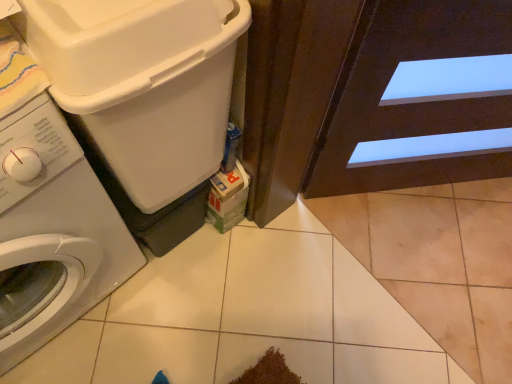
Question: Considering the positions of white plastic washing machine at left, the 1th washing machine viewed from the right, and white glossy washing machine at left, which is the second washing machine in right-to-left order, in the image, is white plastic washing machine at left, the 1th washing machine viewed from the right, taller or shorter than white glossy washing machine at left, which is the second washing machine in right-to-left order,?

Choices:
 (A) tall
 (B) short

Answer: (B)

Question: Looking at their shapes, would you say white plastic washing machine at left, the 2th washing machine when ordered from left to right, is wider or thinner than white glossy washing machine at left, placed as the 1th washing machine when sorted from left to right?

Choices:
 (A) thin
 (B) wide

Answer: (A)

Question: From the image's perspective, is white plastic washing machine at left, the 1th washing machine viewed from the right, above or below white glossy washing machine at left, placed as the 1th washing machine when sorted from left to right?

Choices:
 (A) above
 (B) below

Answer: (A)

Question: Considering the positions of point (37, 322) and point (109, 36), is point (37, 322) closer or farther from the camera than point (109, 36)?

Choices:
 (A) farther
 (B) closer

Answer: (A)

Question: From a real-world perspective, is white glossy washing machine at left, placed as the 1th washing machine when sorted from left to right, physically located above or below white plastic washing machine at left, the 2th washing machine when ordered from left to right?

Choices:
 (A) below
 (B) above

Answer: (A)

Question: Is white glossy washing machine at left, which is the second washing machine in right-to-left order, wider or thinner than white plastic washing machine at left, the 2th washing machine when ordered from left to right?

Choices:
 (A) thin
 (B) wide

Answer: (B)

Question: Is white glossy washing machine at left, placed as the 1th washing machine when sorted from left to right, bigger or smaller than white plastic washing machine at left, the 1th washing machine viewed from the right?

Choices:
 (A) small
 (B) big

Answer: (B)